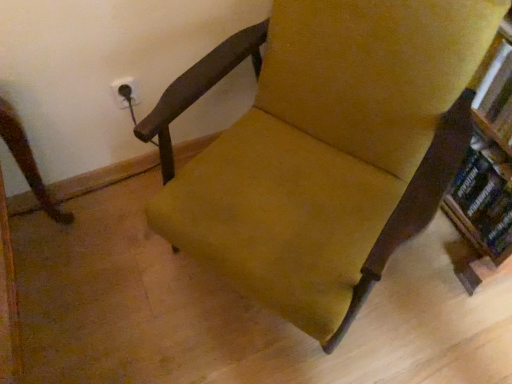
Question: From the image's perspective, is hardcover book at right located above or below velvet yellow chair at center?

Choices:
 (A) above
 (B) below

Answer: (B)

Question: In the image, is hardcover book at right positioned in front of or behind velvet yellow chair at center?

Choices:
 (A) front
 (B) behind

Answer: (B)

Question: Does point (500, 173) appear closer or farther from the camera than point (268, 163)?

Choices:
 (A) closer
 (B) farther

Answer: (B)

Question: From a real-world perspective, is velvet yellow chair at center above or below hardcover book at right?

Choices:
 (A) above
 (B) below

Answer: (A)

Question: Is point (437, 115) closer or farther from the camera than point (486, 157)?

Choices:
 (A) farther
 (B) closer

Answer: (B)

Question: Would you say velvet yellow chair at center is inside or outside hardcover book at right?

Choices:
 (A) inside
 (B) outside

Answer: (B)

Question: From the image's perspective, relative to hardcover book at right, is velvet yellow chair at center above or below?

Choices:
 (A) above
 (B) below

Answer: (A)